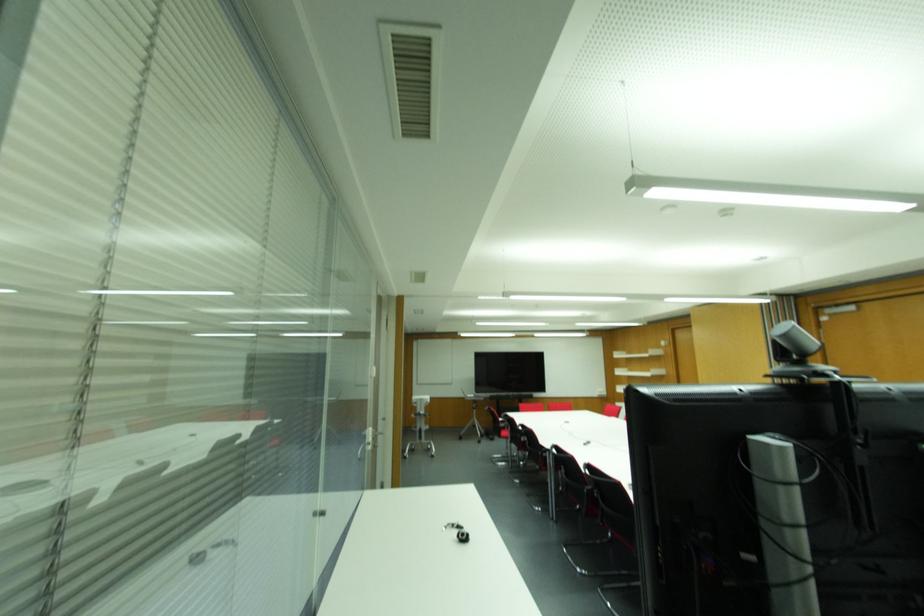
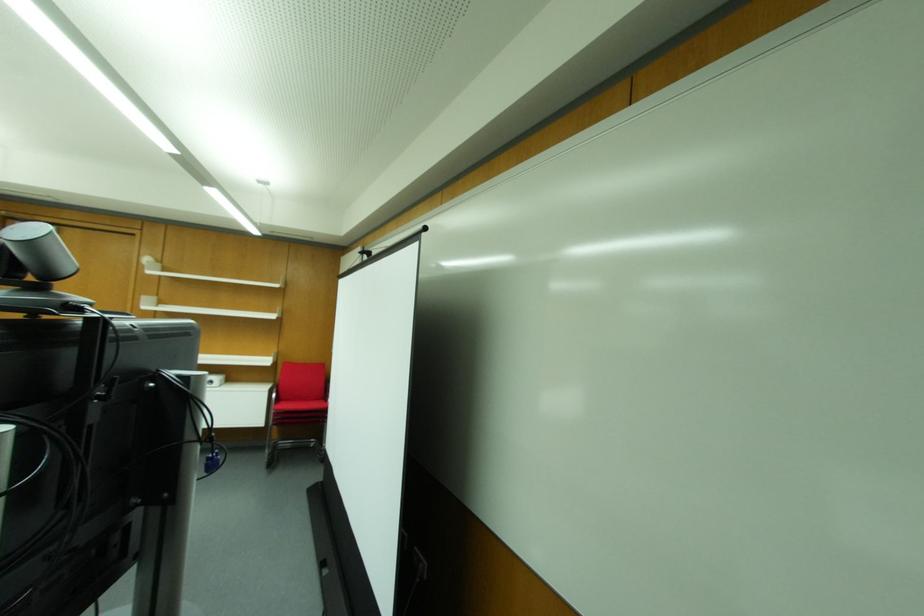
Where in the second image is the point corresponding to [840,385] from the first image?

(98, 323)